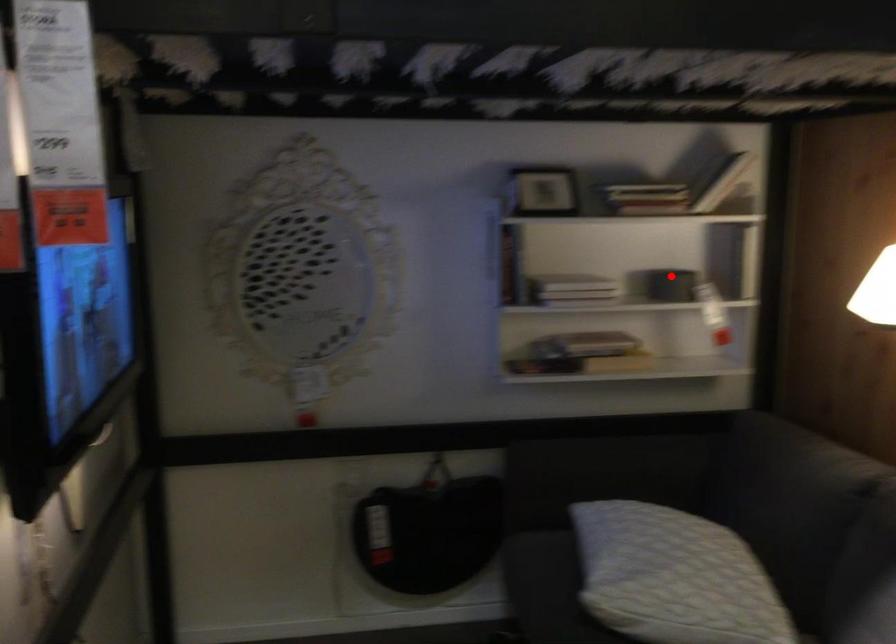
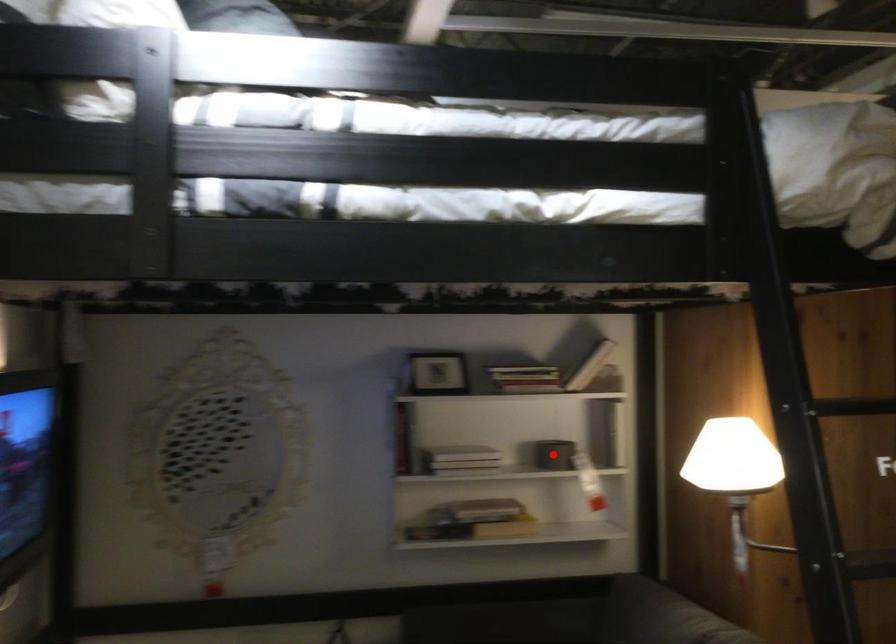
From the picture: I am providing you with two images of the same scene from different viewpoints. A red point is marked on the first image and another point is marked on the second image. Are the points marked in image1 and image2 representing the same 3D position?

Yes